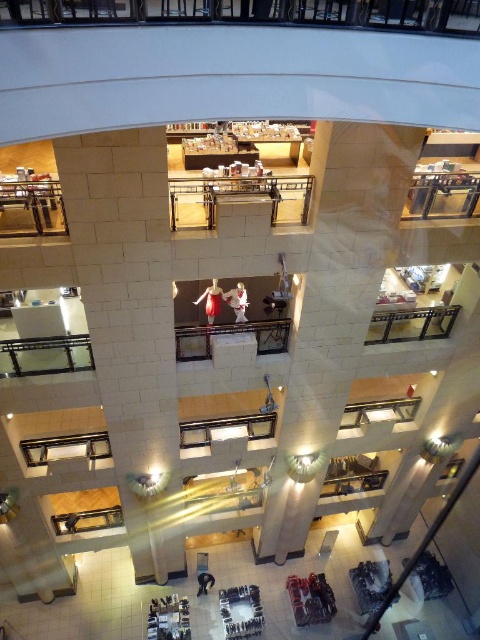
Does white stone pillar at center have a lesser height compared to matte red dress at center?

In fact, white stone pillar at center may be taller than matte red dress at center.

Consider the image. Does white stone pillar at center have a greater width compared to matte red dress at center?

Indeed, white stone pillar at center has a greater width compared to matte red dress at center.

The height and width of the screenshot is (640, 480). Find the location of `white stone pillar at center`. white stone pillar at center is located at coordinates (130, 324).

Is white marble pillar at center below white fabric dress at center?

Indeed, white marble pillar at center is positioned under white fabric dress at center.

Looking at this image, is white marble pillar at center positioned in front of white fabric dress at center?

Yes, it is in front of white fabric dress at center.

Between point (285, 484) and point (237, 308), which one is positioned in front?

Point (237, 308) is in front.

The image size is (480, 640). What are the coordinates of `white marble pillar at center` in the screenshot? It's located at (334, 308).

Does white stone pillar at center come behind white fabric dress at center?

No, it is in front of white fabric dress at center.

Can you confirm if white stone pillar at center is positioned to the right of white fabric dress at center?

Incorrect, white stone pillar at center is not on the right side of white fabric dress at center.

You are a GUI agent. You are given a task and a screenshot of the screen. Output one action in this format:
    pyautogui.click(x=<x>, y=<y>)
    Task: Click on the white stone pillar at center
    This screenshot has height=640, width=480.
    Given the screenshot: What is the action you would take?
    (x=130, y=324)

This screenshot has width=480, height=640. In order to click on white stone pillar at center in this screenshot , I will do `click(130, 324)`.